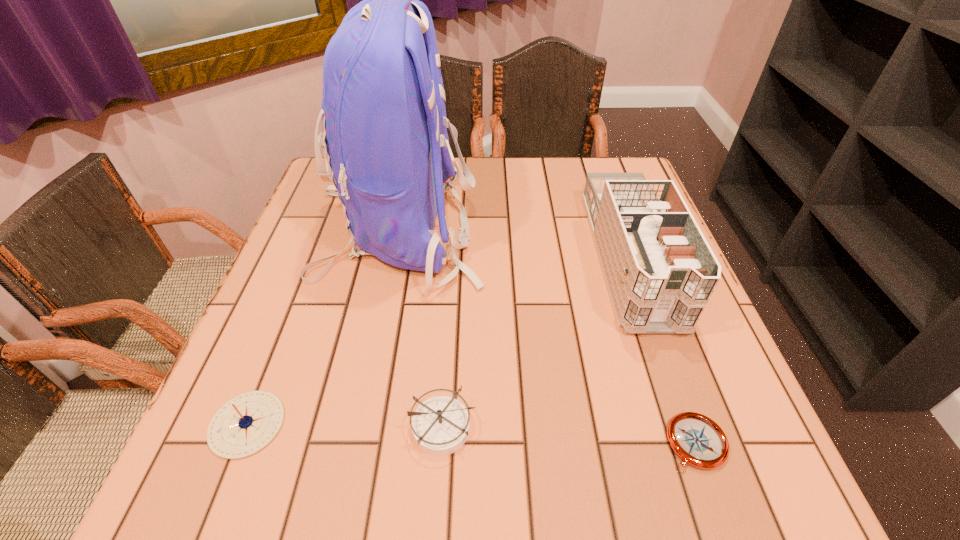
Identify the location of object that is at the near right corner. This screenshot has height=540, width=960. (x=699, y=441).

This screenshot has width=960, height=540. I want to click on free space at the far edge, so click(484, 156).

Image resolution: width=960 pixels, height=540 pixels. What are the coordinates of `vacant space at the near edge of the desktop` in the screenshot? It's located at (320, 485).

At what (x,y) coordinates should I click in order to perform the action: click on blank space at the left edge. Please return your answer as a coordinate pair (x, y). This screenshot has height=540, width=960. Looking at the image, I should click on (256, 315).

Where is `blank space at the right edge of the desktop`? This screenshot has height=540, width=960. blank space at the right edge of the desktop is located at coordinates (736, 381).

Where is `vacant region at the far left corner`? This screenshot has width=960, height=540. vacant region at the far left corner is located at coordinates (331, 196).

Find the location of a particular element. The height and width of the screenshot is (540, 960). free space at the far right corner of the desktop is located at coordinates pos(611,159).

Find the location of a particular element. free space between the tallest object and the rightmost compass is located at coordinates (547, 336).

This screenshot has width=960, height=540. What are the coordinates of `vacant region between the dollhouse and the tallest object` in the screenshot? It's located at (514, 244).

Where is `free space between the tallest object and the leftmost compass`? free space between the tallest object and the leftmost compass is located at coordinates (323, 327).